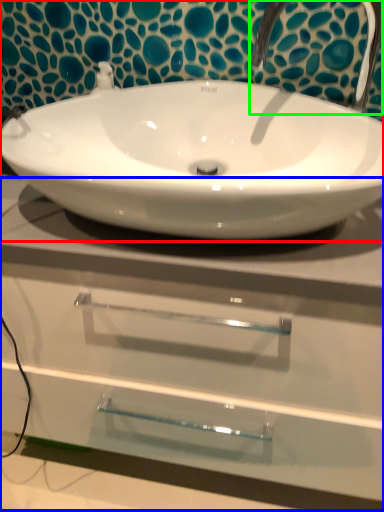
Question: Estimate the real-world distances between objects in this image. Which object is closer to sink (highlighted by a red box), counter top (highlighted by a blue box) or plumbing fixture (highlighted by a green box)?

Choices:
 (A) counter top
 (B) plumbing fixture

Answer: (B)